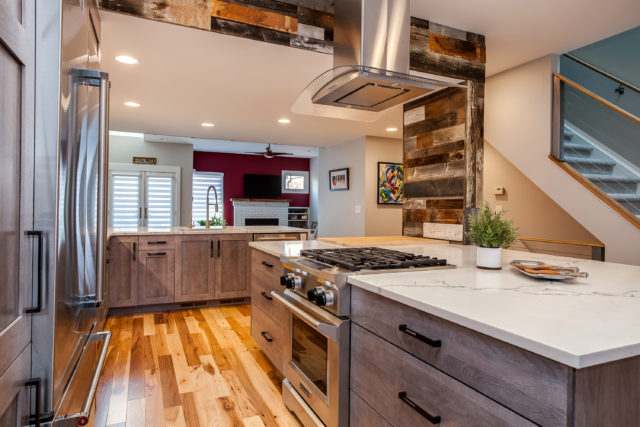
The width and height of the screenshot is (640, 427). In order to click on stairs in this screenshot , I will do pos(637,215), pos(628,195), pos(614,178), pos(598,160), pos(580,146), pos(566,132).